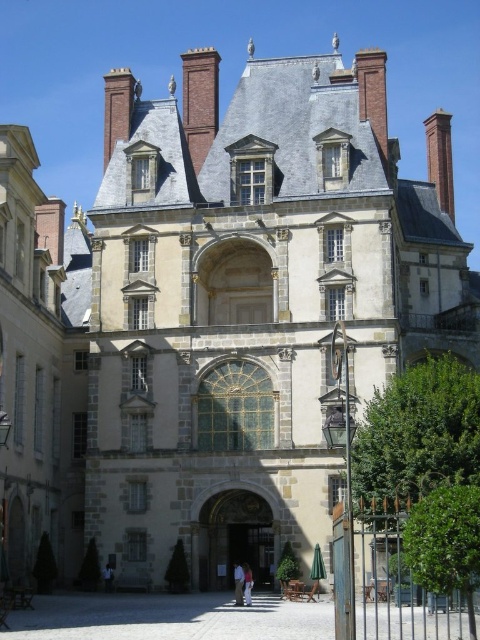
Looking at this image, does brown wooden door at center have a greater height compared to white cotton shirt at center?

Correct, brown wooden door at center is much taller as white cotton shirt at center.

Is point (272, 544) farther from camera compared to point (244, 596)?

Yes.

Between point (208, 579) and point (249, 566), which one is positioned behind?

The point (249, 566) is more distant.

Find the location of `brown wooden door at center`. brown wooden door at center is located at coordinates (235, 538).

Who is higher up, brown wooden door at center or light brown leather jacket at center?

Positioned higher is brown wooden door at center.

Is brown wooden door at center closer to camera compared to light brown leather jacket at center?

No, it is not.

I want to click on brown wooden door at center, so click(x=235, y=538).

Between point (222, 422) and point (243, 563), which one is positioned behind?

Positioned behind is point (243, 563).

Who is more forward, (411, 180) or (251, 572)?

Point (251, 572) is in front.

Is point (162, 554) farther from viewer compared to point (251, 600)?

Yes, it is.

This screenshot has height=640, width=480. Identify the location of smooth stone mansion at center. (253, 292).